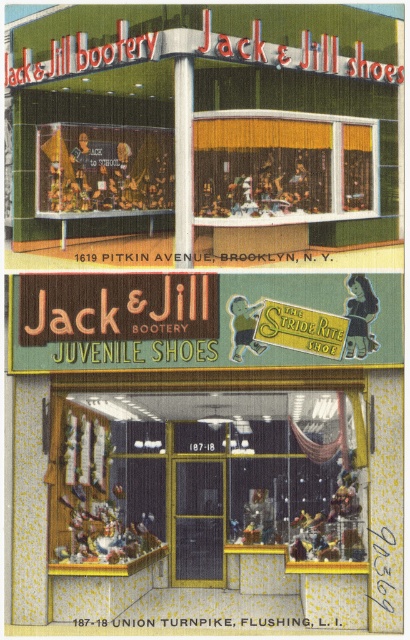
Question: Is wooden display case at center smaller than green fabric signboard at center?

Choices:
 (A) yes
 (B) no

Answer: (B)

Question: Is wooden display case at center thinner than green fabric signboard at center?

Choices:
 (A) yes
 (B) no

Answer: (B)

Question: Which of the following is the farthest from the observer?

Choices:
 (A) green fabric signboard at center
 (B) wooden display case at center

Answer: (B)

Question: Which object is farther from the camera taking this photo?

Choices:
 (A) wooden display case at center
 (B) green fabric signboard at center

Answer: (A)

Question: Does wooden display case at center have a lesser width compared to green fabric signboard at center?

Choices:
 (A) yes
 (B) no

Answer: (B)